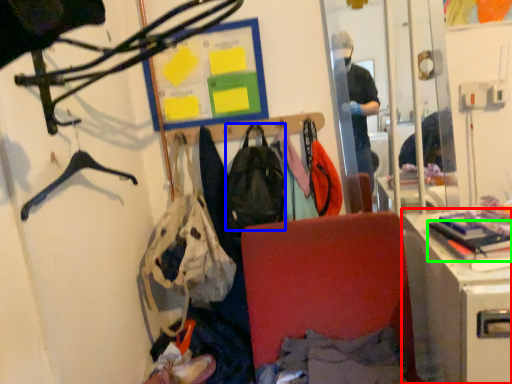
Question: Estimate the real-world distances between objects in this image. Which object is closer to desk (highlighted by a red box), backpack (highlighted by a blue box) or book (highlighted by a green box)?

Choices:
 (A) backpack
 (B) book

Answer: (B)